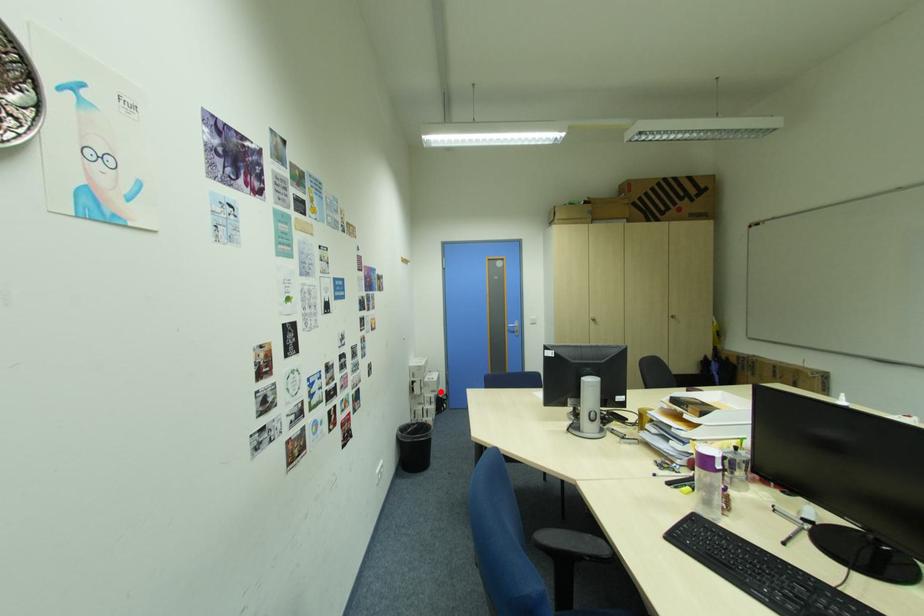
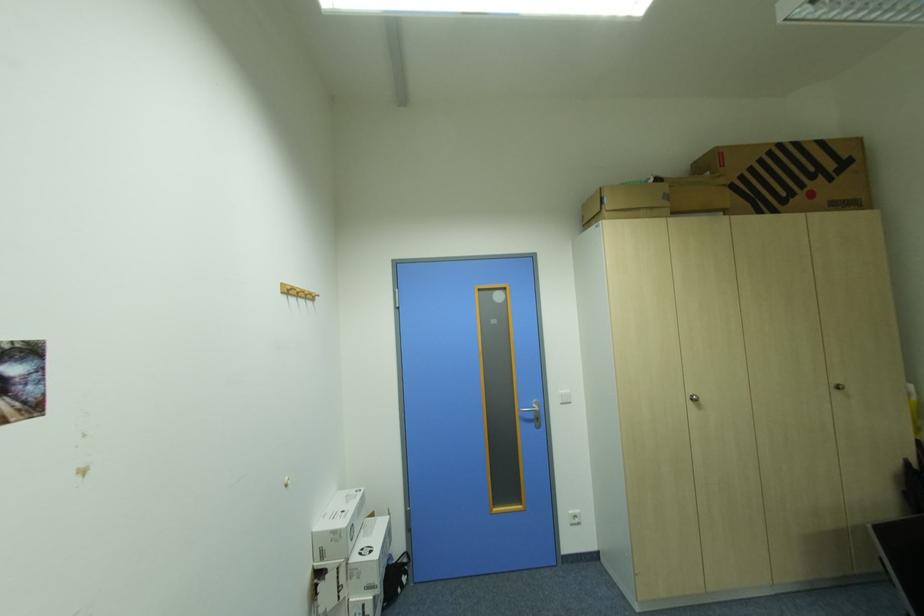
Locate, in the second image, the point that corresponds to the highlighted location in the first image.

(377, 590)